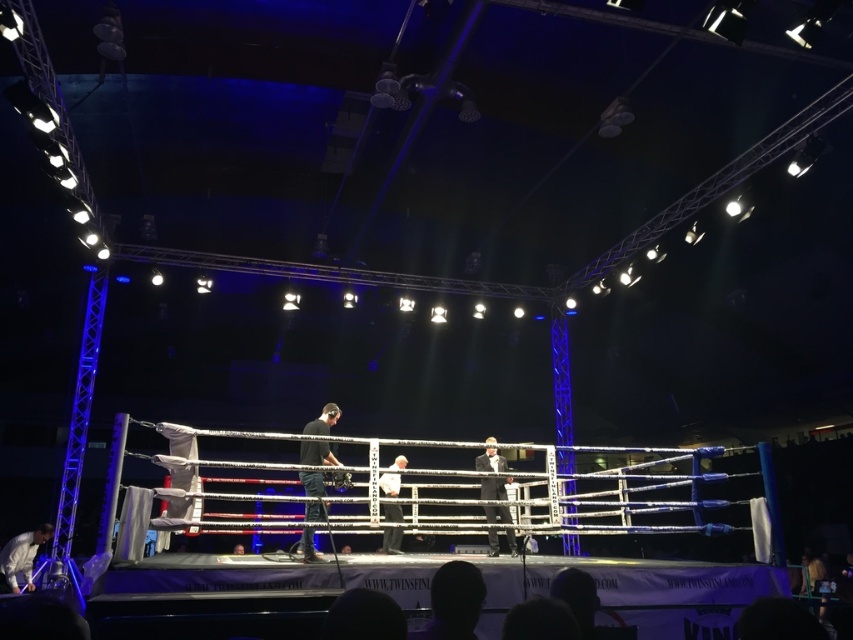
Question: In this image, where is shiny black suit at center located relative to white fabric shirt at center?

Choices:
 (A) above
 (B) below

Answer: (B)

Question: Does shiny black suit at center have a greater width compared to white fabric shirt at center?

Choices:
 (A) yes
 (B) no

Answer: (A)

Question: Is black matte camera at center thinner than white fabric shirt at center?

Choices:
 (A) yes
 (B) no

Answer: (B)

Question: Considering the real-world distances, which object is closest to the shiny black suit at center?

Choices:
 (A) black matte camera at center
 (B) white fabric shirt at center
 (C) white fabric at lower left

Answer: (B)

Question: Which object is the farthest from the white fabric at lower left?

Choices:
 (A) shiny black suit at center
 (B) white fabric shirt at center

Answer: (A)

Question: Which object is the farthest from the white fabric at lower left?

Choices:
 (A) white fabric shirt at center
 (B) black matte camera at center
 (C) shiny black suit at center

Answer: (C)